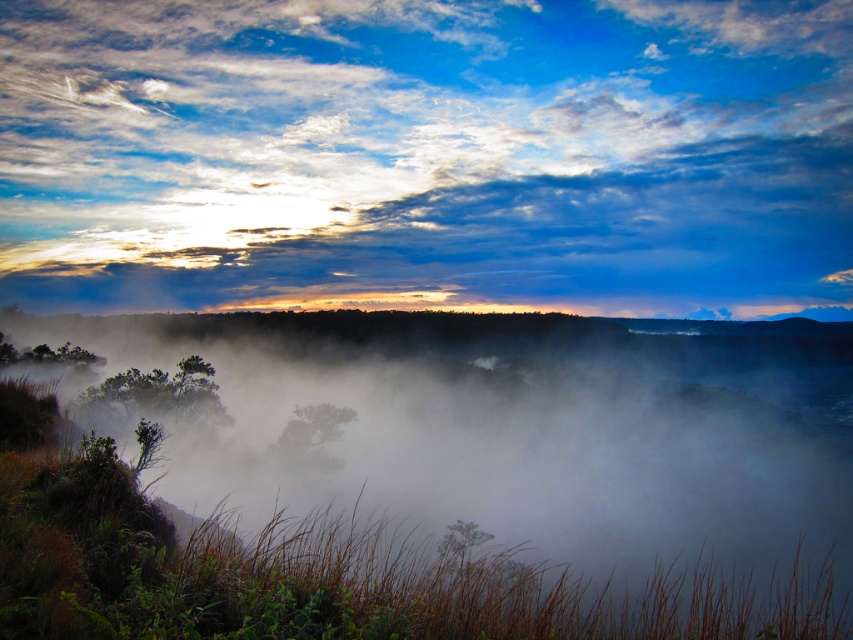
Is cloudy sky at upper center bigger than white misty fog at center?

Yes, cloudy sky at upper center is bigger than white misty fog at center.

Does cloudy sky at upper center appear on the right side of white misty fog at center?

In fact, cloudy sky at upper center is to the left of white misty fog at center.

Where is `cloudy sky at upper center`? This screenshot has height=640, width=853. cloudy sky at upper center is located at coordinates (427, 156).